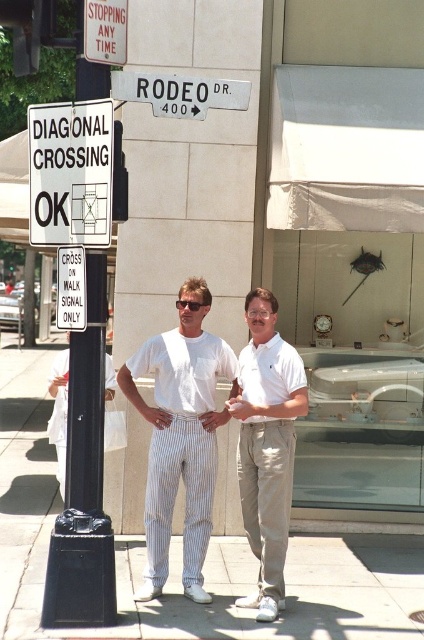
Question: Does white plastic sign at upper left appear under black plastic sunglasses at center?

Choices:
 (A) yes
 (B) no

Answer: (B)

Question: Among these objects, which one is farthest from the camera?

Choices:
 (A) white cotton shirt at center
 (B) gray concrete pavement at lower center

Answer: (A)

Question: Among these points, which one is nearest to the camera?

Choices:
 (A) (49, 428)
 (B) (69, 253)
 (C) (111, 160)
 (D) (247, 413)

Answer: (C)

Question: Does white striped pants at left have a smaller size compared to black plastic sunglasses at center?

Choices:
 (A) no
 (B) yes

Answer: (A)

Question: Is white striped pants at center in front of white plastic street sign at upper center?

Choices:
 (A) no
 (B) yes

Answer: (A)

Question: Which object appears closest to the camera in this image?

Choices:
 (A) black plastic sunglasses at center
 (B) black metal sign at upper left
 (C) white plastic sign at upper left
 (D) gray concrete pavement at lower center

Answer: (C)